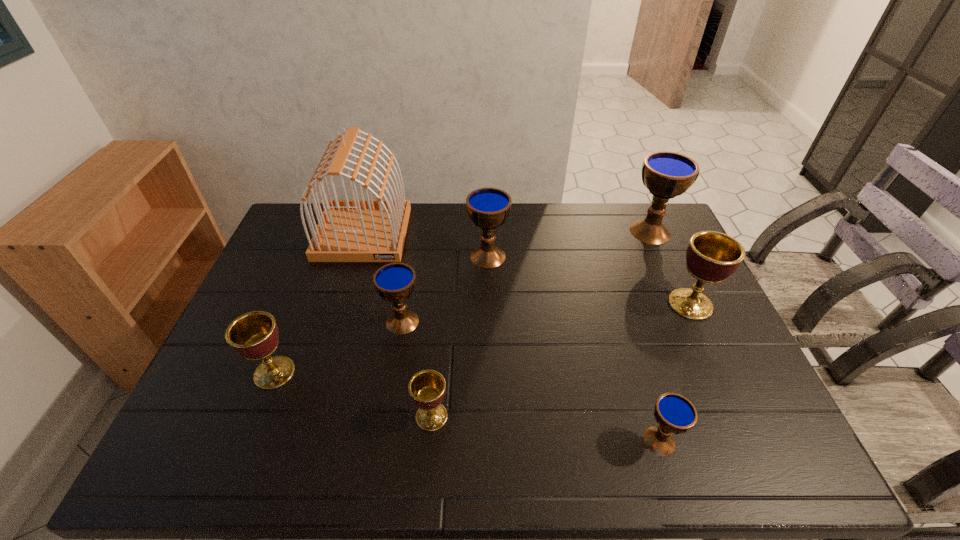
This screenshot has height=540, width=960. I want to click on vacant region at the far edge, so click(x=477, y=231).

I want to click on free space at the near edge of the desktop, so click(553, 458).

At what (x,y) coordinates should I click in order to perform the action: click on free region at the left edge. Please return your answer as a coordinate pair (x, y). This screenshot has height=540, width=960. Looking at the image, I should click on (297, 283).

What are the coordinates of `free space at the right edge of the desktop` in the screenshot? It's located at (695, 283).

Identify the location of free point at the far left corner. (295, 224).

This screenshot has width=960, height=540. Identify the location of vacant point located between the fourth chalice from right to left and the sixth farthest object. (381, 314).

You are a GUI agent. You are given a task and a screenshot of the screen. Output one action in this format:
    pyautogui.click(x=<x>, y=<y>)
    Task: Click on the free spot between the third biggest blue chalice and the second nearest golden chalice
    
    Given the screenshot: What is the action you would take?
    pyautogui.click(x=339, y=347)

Where is `vacant point located between the biggest golden chalice and the biggest blue chalice`? The width and height of the screenshot is (960, 540). vacant point located between the biggest golden chalice and the biggest blue chalice is located at coordinates (670, 268).

This screenshot has height=540, width=960. Find the location of `free space that is in between the biggest golden chalice and the tallest object`. free space that is in between the biggest golden chalice and the tallest object is located at coordinates (527, 269).

Where is `vacant area that lies between the leftmost chalice and the beige birdcage`? The height and width of the screenshot is (540, 960). vacant area that lies between the leftmost chalice and the beige birdcage is located at coordinates (319, 303).